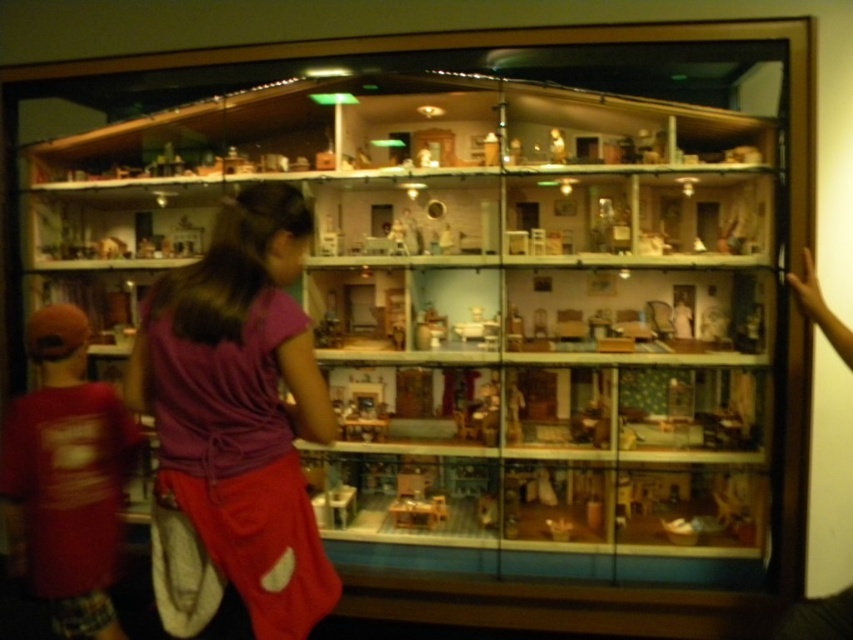
Is purple fabric skirt at center wider than matte red shirt at left?

Yes.

Is point (265, 444) positioned in front of point (28, 504)?

Yes, point (265, 444) is closer to viewer.

Who is more forward, (230, 228) or (93, 417)?

Point (230, 228) is more forward.

This screenshot has height=640, width=853. Identify the location of purple fabric skirt at center. (241, 406).